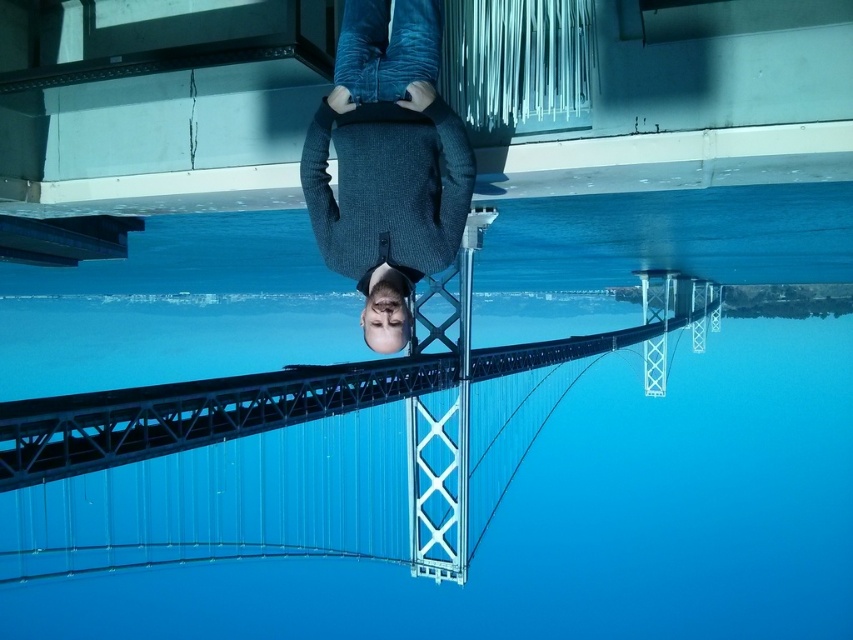
Between blue glass swimming pool at center and dark blue sweater at center, which one is positioned higher?

Positioned higher is dark blue sweater at center.

Between point (782, 529) and point (405, 109), which one is positioned behind?

Positioned behind is point (782, 529).

Who is more distant from viewer, (581, 490) or (430, 74)?

Positioned behind is point (581, 490).

You are a GUI agent. You are given a task and a screenshot of the screen. Output one action in this format:
    pyautogui.click(x=<x>, y=<y>)
    Task: Click on the blue glass swimming pool at center
    This screenshot has height=640, width=853.
    Given the screenshot: What is the action you would take?
    pyautogui.click(x=578, y=522)

Between blue glass swimming pool at center and metallic bridge rail at center, which one has less height?

With less height is metallic bridge rail at center.

The height and width of the screenshot is (640, 853). Describe the element at coordinates (578, 522) in the screenshot. I see `blue glass swimming pool at center` at that location.

You are a GUI agent. You are given a task and a screenshot of the screen. Output one action in this format:
    pyautogui.click(x=<x>, y=<y>)
    Task: Click on the blue glass swimming pool at center
    
    Given the screenshot: What is the action you would take?
    pyautogui.click(x=578, y=522)

Between point (378, 97) and point (1, 422), which one is positioned behind?

Point (1, 422)

Is point (346, 221) more distant than point (103, 442)?

No, (346, 221) is closer to viewer.

Find the location of `dark blue sweater at center`. dark blue sweater at center is located at coordinates (387, 163).